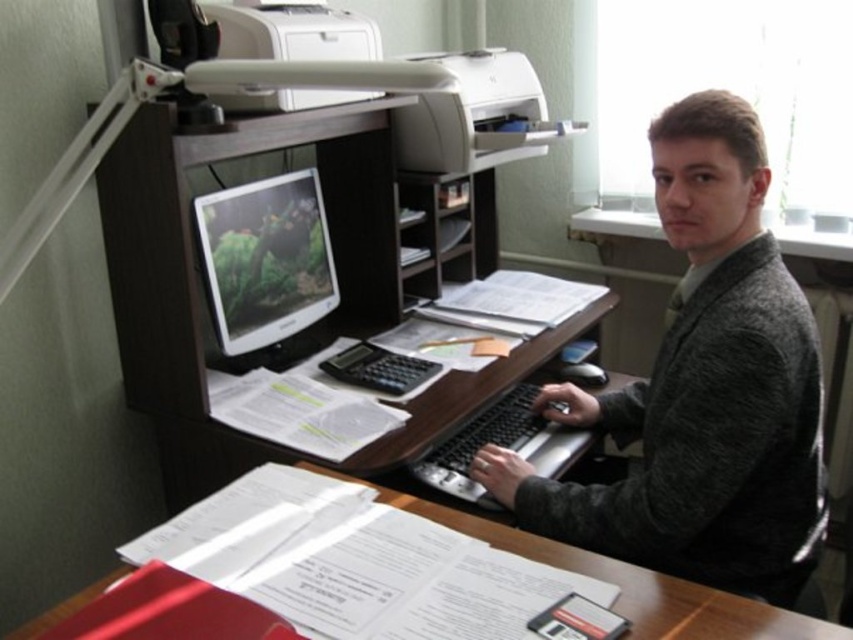
You are looking at the workspace setup. There are two points marked in the image, one at coordinates point (x=254, y=356) and another at point (x=643, y=579). Which of these points is closer to you?

Point (x=254, y=356) is further to the camera than point (x=643, y=579), so the point closer to you is point (x=643, y=579).

You are a delivery person standing in the office and need to place a package on the desk. The package requires a flat surface that is at least 1.5 meters away from the matte black monitor at center to avoid blocking the screen. Can you place the package on the desk without violating this requirement?

The distance between the matte black monitor at center and the viewer is 1.49 meters, which is less than the required 1.5 meters. Therefore, you cannot place the package on the desk without violating the requirement.